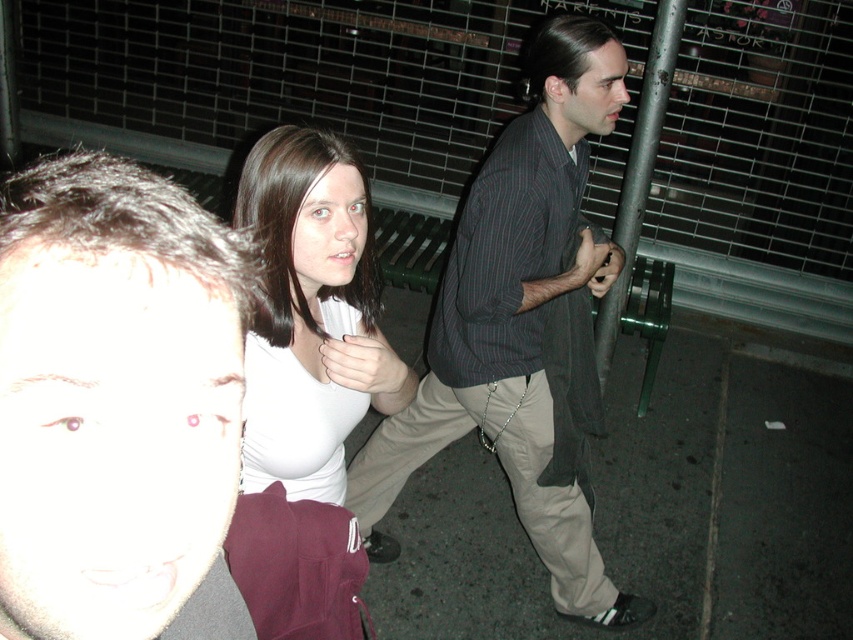
You are a photographer trying to capture a candid shot of the smooth skin face at lower left and the white matte shirt at center. Based on their positions, can you tell which one is closer to the camera?

The smooth skin face at lower left is below the white matte shirt at center, which means the smooth skin face at lower left is closer to the camera.